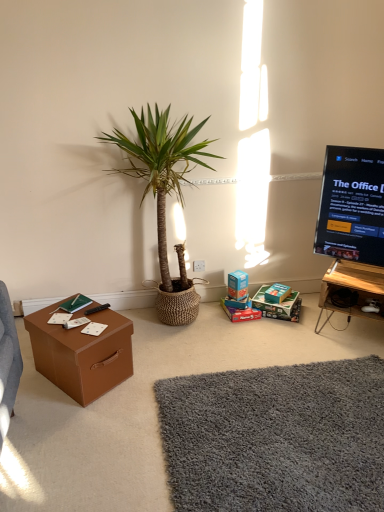
Image resolution: width=384 pixels, height=512 pixels. Find the location of `vacant region to the left of black plastic remote control at lower left`. vacant region to the left of black plastic remote control at lower left is located at coordinates (67, 314).